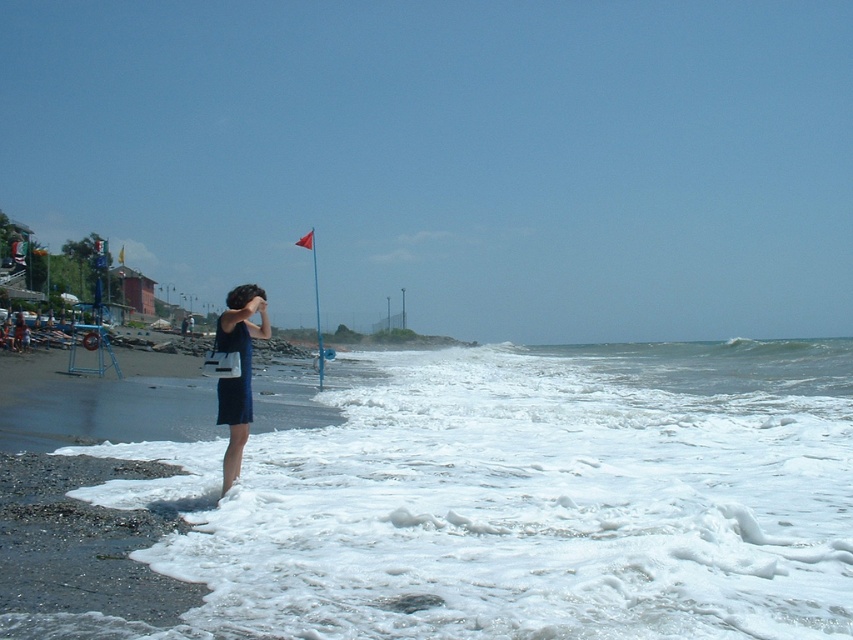
Is point (268, 499) positioned behind point (227, 340)?

Yes.

Locate an element on the screen. The width and height of the screenshot is (853, 640). white foamy water at lower left is located at coordinates (547, 499).